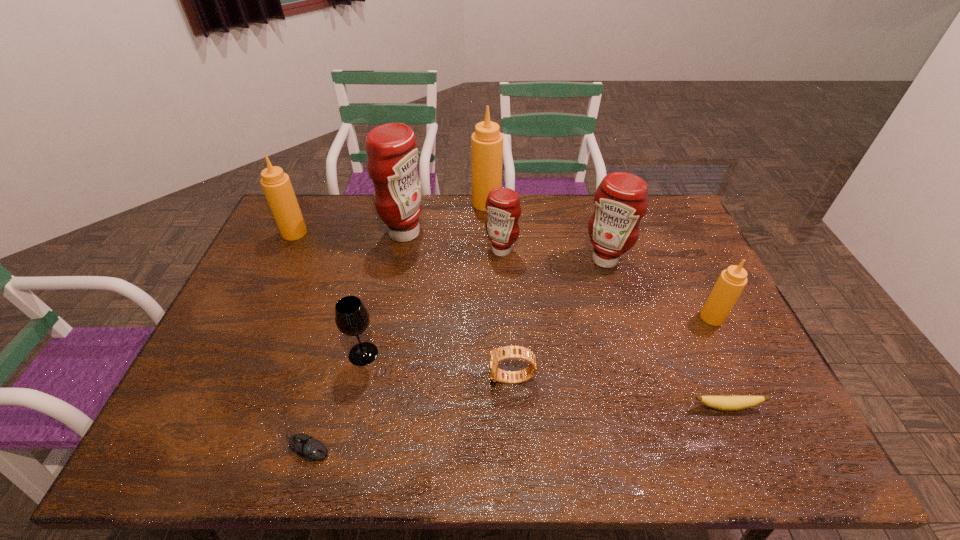
This screenshot has width=960, height=540. Find the location of `free space located 0.070m on the right of the fifth condiment from left to right`. free space located 0.070m on the right of the fifth condiment from left to right is located at coordinates (648, 260).

This screenshot has width=960, height=540. In order to click on free space located 0.220m on the right of the leftmost tan condiment in this screenshot , I will do `click(370, 233)`.

This screenshot has height=540, width=960. Identify the location of free spot located 0.080m on the back of the smallest tan condiment. pyautogui.click(x=699, y=289).

In order to click on free space located on the left of the smallest red condiment in this screenshot , I will do `click(468, 251)`.

Where is `vacant space located on the left of the wineglass`? This screenshot has height=540, width=960. vacant space located on the left of the wineglass is located at coordinates (288, 354).

Locate an element on the screen. vacant space located 0.330m on the face of the watch is located at coordinates (360, 379).

The width and height of the screenshot is (960, 540). What are the coordinates of `vacant space located on the face of the watch` in the screenshot? It's located at (446, 379).

Identify the location of vacant space located 0.180m on the face of the watch. (419, 379).

Locate an element on the screen. The width and height of the screenshot is (960, 540). vacant space located 0.230m on the left of the ninth tallest object is located at coordinates pyautogui.click(x=595, y=407).

The image size is (960, 540). I want to click on vacant region located 0.250m on the left of the computer mouse, so click(x=172, y=448).